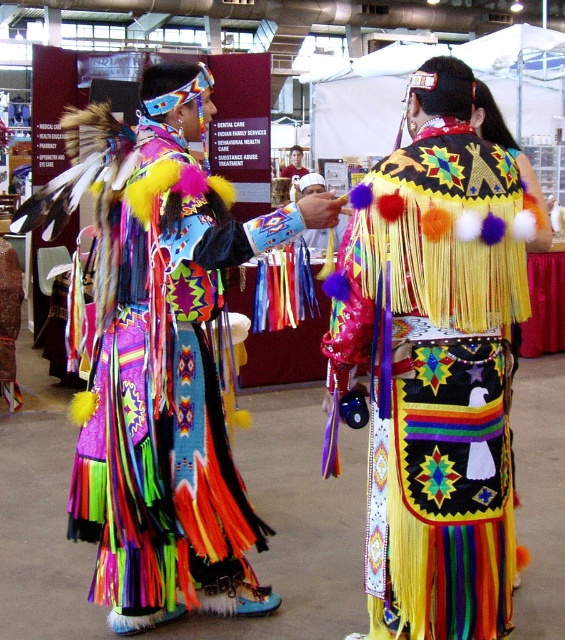
Question: Is multicolored fringed dress at center to the right of multicolored fringed dress at left from the viewer's perspective?

Choices:
 (A) yes
 (B) no

Answer: (A)

Question: Can you confirm if multicolored fringed dress at center is thinner than multicolored fringed dress at left?

Choices:
 (A) yes
 (B) no

Answer: (A)

Question: Which object appears closest to the camera in this image?

Choices:
 (A) multicolored fringed dress at center
 (B) multicolored fringed dress at left

Answer: (A)

Question: Which point is farther to the camera?

Choices:
 (A) multicolored fringed dress at left
 (B) multicolored fringed dress at center

Answer: (A)

Question: Does multicolored fringed dress at center have a smaller size compared to multicolored fringed dress at left?

Choices:
 (A) yes
 (B) no

Answer: (A)